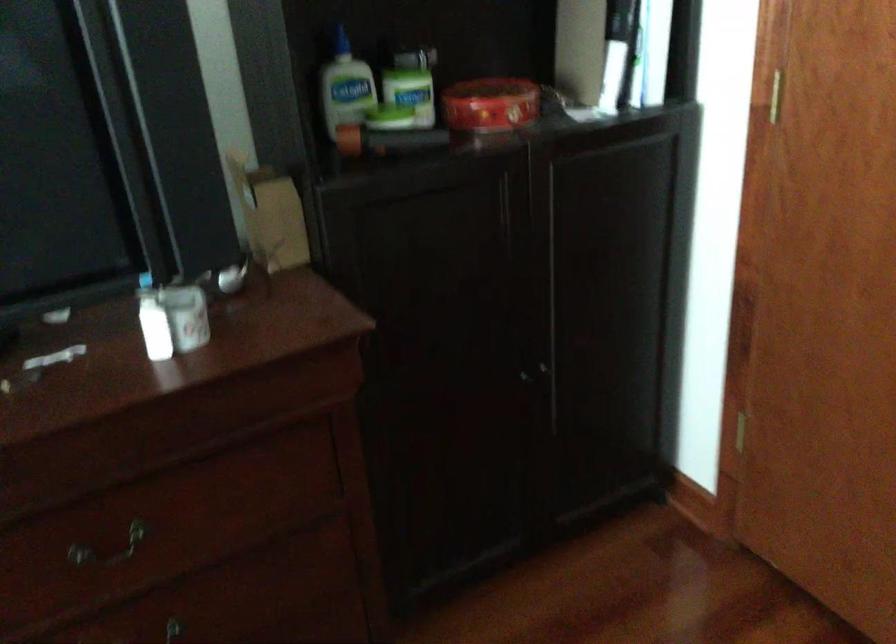
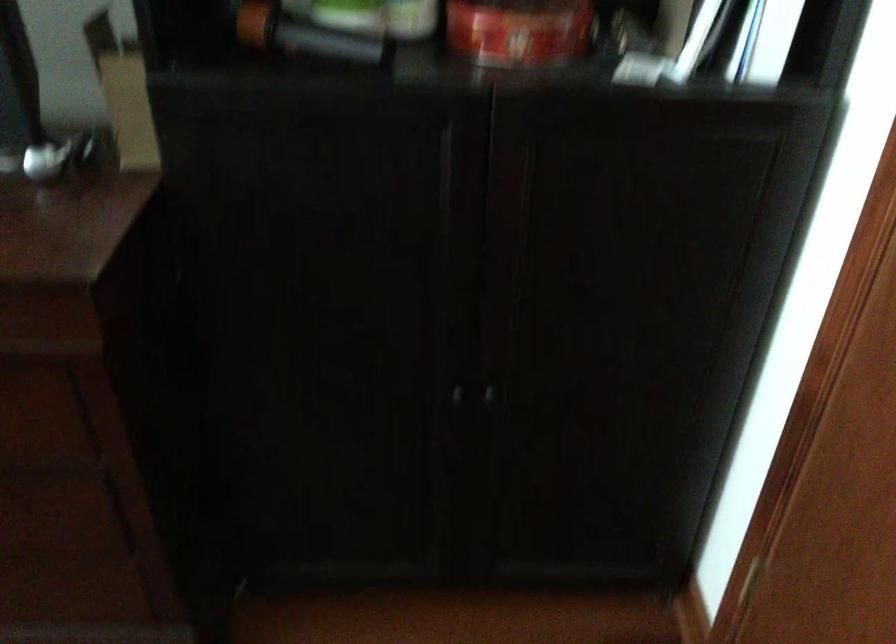
Locate, in the second image, the point that corresponds to pixel 543 373 in the first image.

(487, 395)